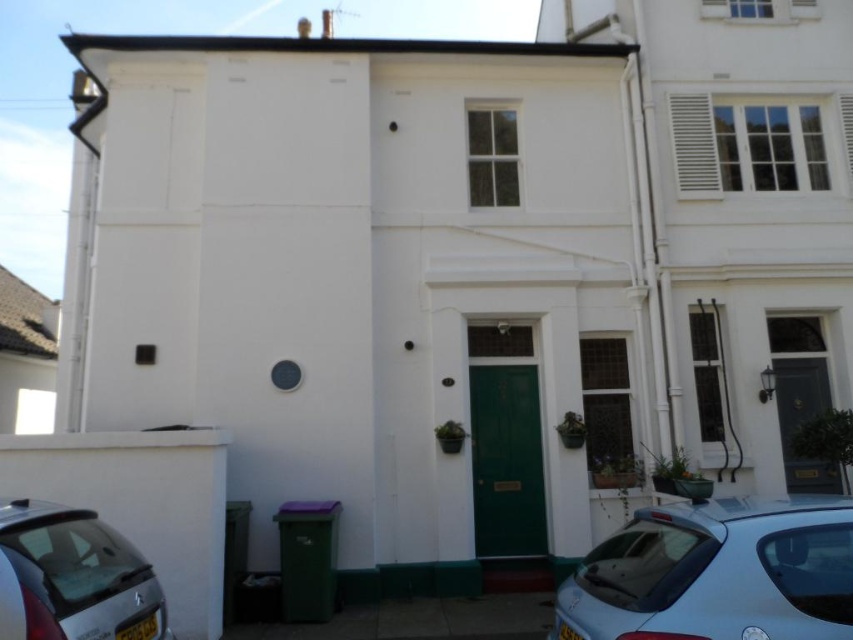
You are standing in front of the house and see a point at coordinates (717,573). Based on the scene, what object is this point located on?

The point at coordinates (717,573) is located on the light blue metallic hatchback at lower right.

You are standing 5 meters away from the house and want to reach a specific point marked at coordinates point (743, 547). Can you walk directly to it from your current position?

The distance of point (743, 547) from camera is 3.63 meters, so since you are currently 5 meters away from the house, you can walk directly to it because the point is closer than your current distance.

From the picture: You are a delivery person arriving at the two story white house with a package. You see a light blue metallic hatchback at lower right and a silver metallic car at lower left in the driveway. If you need to park your van which is 2 meters wide, which car should you move to make space?

The light blue metallic hatchback at lower right is wider than the silver metallic car at lower left. Since your van is 2 meters wide, you should move the wider light blue metallic hatchback at lower right to create enough space for your van.